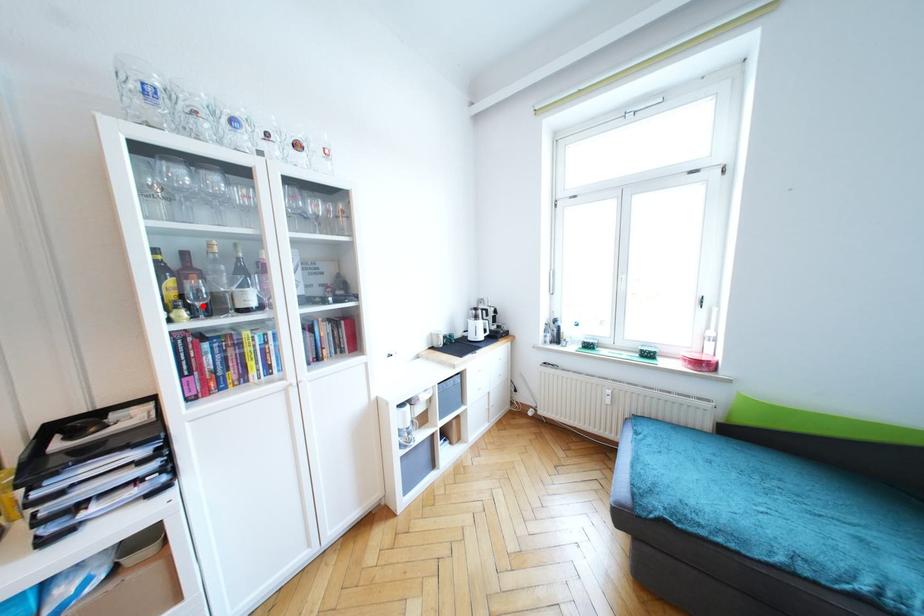
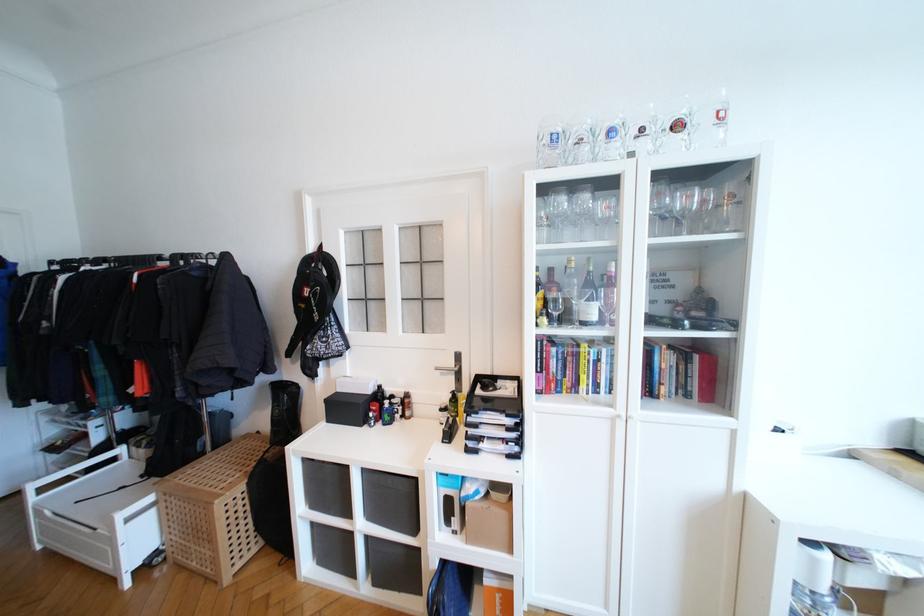
The point at the highlighted location is marked in the first image. Where is the corresponding point in the second image?

(558, 315)